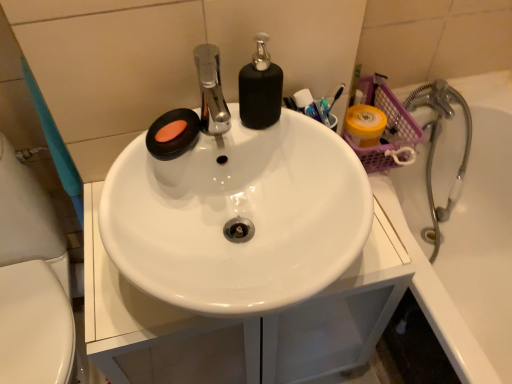
Question: Is black matte soap dispenser at center positioned far away from metallic silver faucet at right?

Choices:
 (A) yes
 (B) no

Answer: (B)

Question: Does black matte soap dispenser at center have a smaller size compared to metallic silver faucet at right?

Choices:
 (A) yes
 (B) no

Answer: (A)

Question: From the image's perspective, would you say black matte soap dispenser at center is shown under metallic silver faucet at right?

Choices:
 (A) no
 (B) yes

Answer: (A)

Question: Can you confirm if black matte soap dispenser at center is thinner than metallic silver faucet at right?

Choices:
 (A) yes
 (B) no

Answer: (A)

Question: Can you confirm if black matte soap dispenser at center is shorter than metallic silver faucet at right?

Choices:
 (A) yes
 (B) no

Answer: (A)

Question: Based on their sizes in the image, would you say white glossy sink at center is bigger or smaller than black matte soap dispenser at center?

Choices:
 (A) big
 (B) small

Answer: (A)

Question: Relative to black matte soap dispenser at center, is white glossy sink at center in front or behind?

Choices:
 (A) behind
 (B) front

Answer: (B)

Question: Considering the relative positions of white glossy sink at center and black matte soap dispenser at center in the image provided, is white glossy sink at center to the left or to the right of black matte soap dispenser at center?

Choices:
 (A) left
 (B) right

Answer: (A)

Question: Considering the positions of white glossy sink at center and black matte soap dispenser at center in the image, is white glossy sink at center wider or thinner than black matte soap dispenser at center?

Choices:
 (A) thin
 (B) wide

Answer: (B)

Question: Looking at the image, does black matte soap dispenser at center seem bigger or smaller compared to matte black soap at upper left?

Choices:
 (A) small
 (B) big

Answer: (B)

Question: From the image's perspective, relative to matte black soap at upper left, is black matte soap dispenser at center above or below?

Choices:
 (A) below
 (B) above

Answer: (B)

Question: From a real-world perspective, is black matte soap dispenser at center above or below matte black soap at upper left?

Choices:
 (A) below
 (B) above

Answer: (B)

Question: Is black matte soap dispenser at center in front of or behind matte black soap at upper left in the image?

Choices:
 (A) behind
 (B) front

Answer: (B)

Question: Based on their sizes in the image, would you say metallic silver faucet at right is bigger or smaller than white glossy sink at center?

Choices:
 (A) small
 (B) big

Answer: (B)

Question: From the image's perspective, is metallic silver faucet at right positioned above or below white glossy sink at center?

Choices:
 (A) above
 (B) below

Answer: (A)